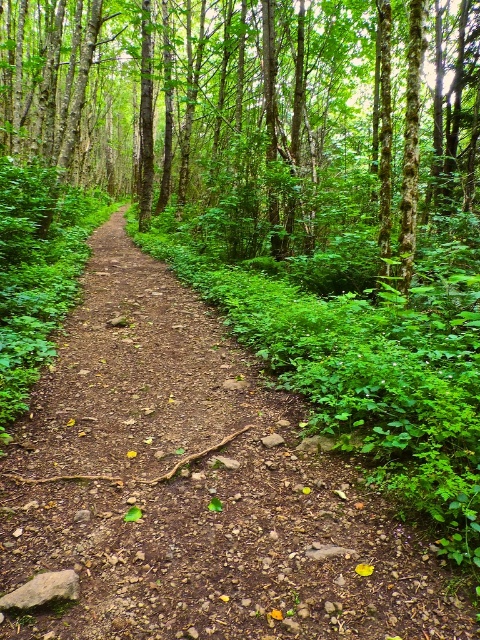
Between brown dirt path at center and brown rough tree at center, which one has less height?

brown dirt path at center

Can you confirm if brown dirt path at center is smaller than brown rough tree at center?

Yes, brown dirt path at center is smaller than brown rough tree at center.

Where is `brown dirt path at center`? brown dirt path at center is located at coordinates (195, 488).